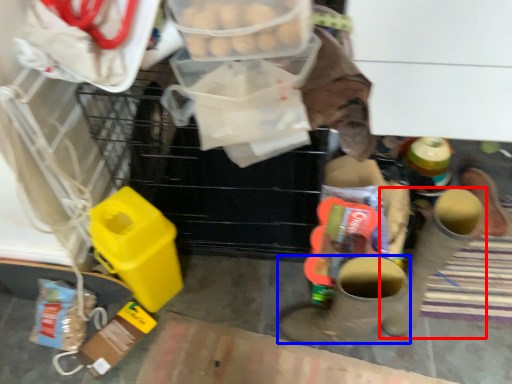
Question: Among these objects, which one is nearest to the camera, footwear (highlighted by a red box) or footwear (highlighted by a blue box)?

Choices:
 (A) footwear
 (B) footwear

Answer: (B)